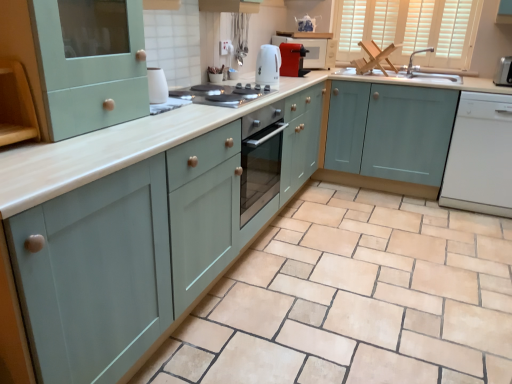
Question: Should I look upward or downward to see white glossy electric kettle at center, which is counted as the 2th appliance, starting from the left?

Choices:
 (A) up
 (B) down

Answer: (A)

Question: Considering the relative sizes of matte teal cabinet at center, the second cabinetry positioned from the right, and matte silver faucet at upper right in the image provided, is matte teal cabinet at center, the second cabinetry positioned from the right, smaller than matte silver faucet at upper right?

Choices:
 (A) no
 (B) yes

Answer: (A)

Question: Is matte teal cabinet at center, placed as the third cabinetry when sorted from left to right, facing away from matte silver faucet at upper right?

Choices:
 (A) yes
 (B) no

Answer: (B)

Question: Is matte teal cabinet at center, the second cabinetry positioned from the right, wider than matte silver faucet at upper right?

Choices:
 (A) yes
 (B) no

Answer: (A)

Question: Is matte teal cabinet at center, placed as the third cabinetry when sorted from left to right, shorter than matte silver faucet at upper right?

Choices:
 (A) yes
 (B) no

Answer: (B)

Question: From the image's perspective, would you say matte teal cabinet at center, placed as the third cabinetry when sorted from left to right, is positioned over matte silver faucet at upper right?

Choices:
 (A) no
 (B) yes

Answer: (A)

Question: Is matte teal cabinet at center, the second cabinetry positioned from the right, to the left of matte silver faucet at upper right from the viewer's perspective?

Choices:
 (A) yes
 (B) no

Answer: (A)

Question: Is matte silver faucet at upper right thinner than wooden shelf at left, placed as the 4th cabinetry when sorted from right to left?

Choices:
 (A) no
 (B) yes

Answer: (A)

Question: Is matte silver faucet at upper right at the left side of wooden shelf at left, which ranks as the 1th cabinetry in left-to-right order?

Choices:
 (A) no
 (B) yes

Answer: (A)

Question: Can you confirm if matte silver faucet at upper right is positioned to the right of wooden shelf at left, which ranks as the 1th cabinetry in left-to-right order?

Choices:
 (A) no
 (B) yes

Answer: (B)

Question: Is matte silver faucet at upper right looking in the opposite direction of wooden shelf at left, which ranks as the 1th cabinetry in left-to-right order?

Choices:
 (A) no
 (B) yes

Answer: (A)

Question: Could you tell me if matte silver faucet at upper right is facing wooden shelf at left, which ranks as the 1th cabinetry in left-to-right order?

Choices:
 (A) no
 (B) yes

Answer: (B)

Question: Is matte silver faucet at upper right bigger than wooden shelf at left, placed as the 4th cabinetry when sorted from right to left?

Choices:
 (A) no
 (B) yes

Answer: (A)

Question: Could you tell me if matte silver faucet at upper right is turned towards white glossy electric stove at center?

Choices:
 (A) no
 (B) yes

Answer: (A)